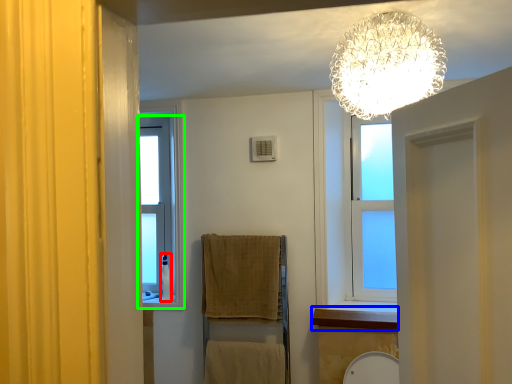
Question: Which is farther away from toiletry (highlighted by a red box)? window sill (highlighted by a blue box) or window (highlighted by a green box)?

Choices:
 (A) window sill
 (B) window

Answer: (A)